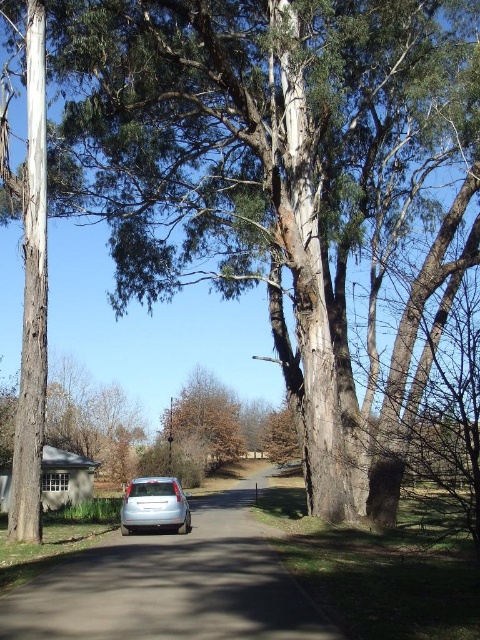
You are standing at the entrance of the driveway and want to walk towards the house. There are two points marked on the driveway, point 1 at coordinates point (99,586) and point 2 at coordinates point (179,490). Which point should you step on first to reach the house faster?

Point (99,586) is closer to the viewer than point (179,490). Therefore, stepping on point (99,586) first will allow you to reach the house faster since it is nearer to your starting position.

You are driving a car and want to park in the driveway. There is a silver metallic car at center and a brown rough tree at center. Which object is blocking the direct path to the parking spot?

The silver metallic car at center is positioned under the brown rough tree at center, so the brown rough tree at center is blocking the direct path to the parking spot.